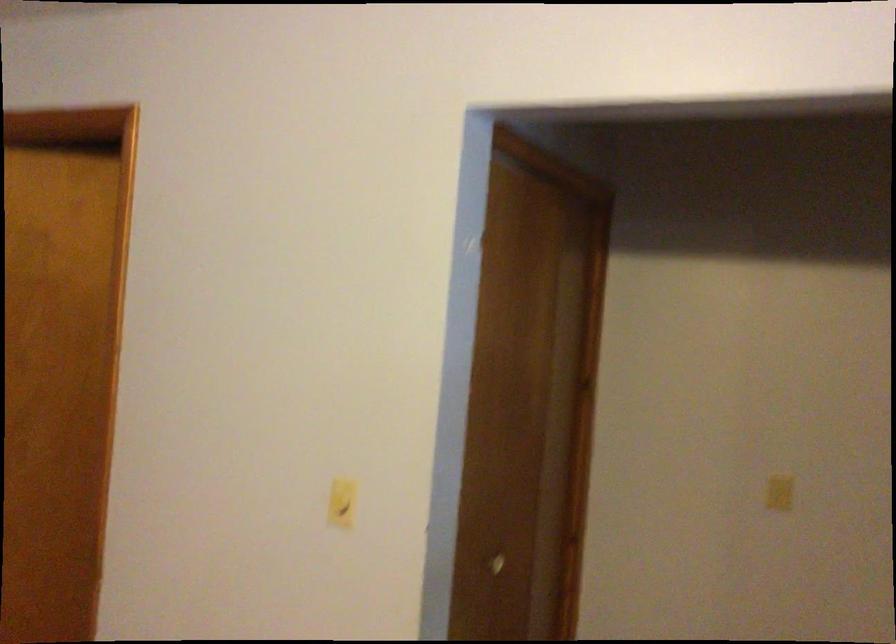
At what (x,y) coordinates should I click in order to perform the action: click on light switch. Please return your answer as a coordinate pair (x, y). The height and width of the screenshot is (644, 896). Looking at the image, I should click on point(340,502).